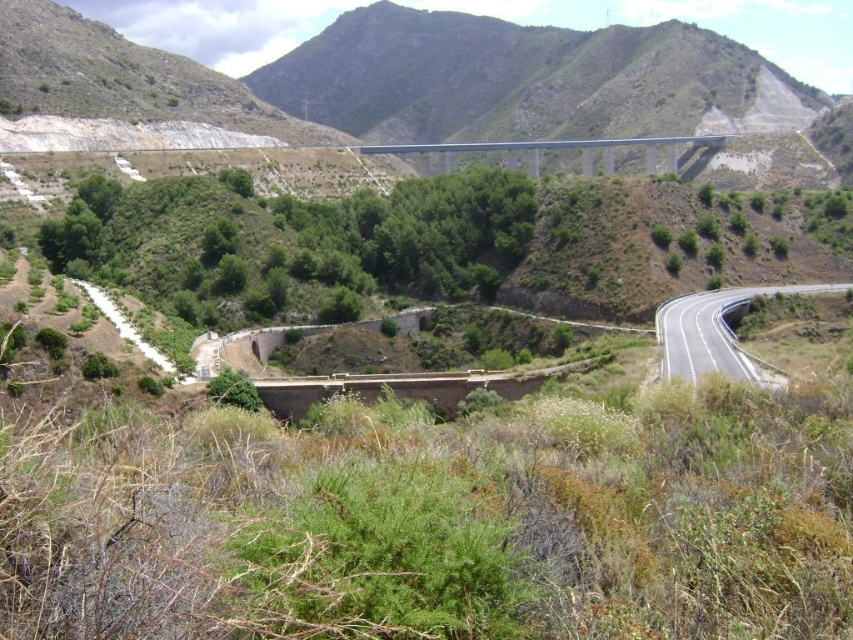
Question: Can you confirm if asphalt road at center is smaller than blue concrete bridge at center?

Choices:
 (A) no
 (B) yes

Answer: (B)

Question: Is asphalt road at center bigger than blue concrete bridge at center?

Choices:
 (A) yes
 (B) no

Answer: (B)

Question: Which of the following is the closest to the observer?

Choices:
 (A) (836, 289)
 (B) (485, 147)

Answer: (A)

Question: Does asphalt road at center lie in front of blue concrete bridge at center?

Choices:
 (A) no
 (B) yes

Answer: (B)

Question: Which point appears closest to the camera in this image?

Choices:
 (A) (723, 340)
 (B) (463, 145)

Answer: (A)